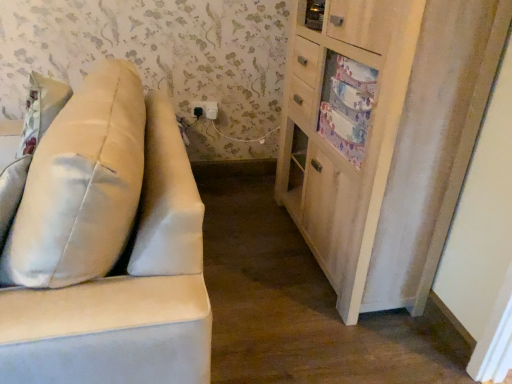
Question: Is satin beige pillow at left further to camera compared to suede-like beige sofa at left?

Choices:
 (A) no
 (B) yes

Answer: (B)

Question: Considering the relative sizes of satin beige pillow at left and suede-like beige sofa at left in the image provided, is satin beige pillow at left thinner than suede-like beige sofa at left?

Choices:
 (A) yes
 (B) no

Answer: (A)

Question: Is satin beige pillow at left closer to the viewer compared to suede-like beige sofa at left?

Choices:
 (A) no
 (B) yes

Answer: (A)

Question: Is suede-like beige sofa at left a part of satin beige pillow at left?

Choices:
 (A) yes
 (B) no

Answer: (B)

Question: Does satin beige pillow at left have a greater height compared to suede-like beige sofa at left?

Choices:
 (A) no
 (B) yes

Answer: (A)

Question: Which is correct: black plastic electric outlet at upper center is inside satin beige pillow at left, or outside of it?

Choices:
 (A) outside
 (B) inside

Answer: (A)

Question: Is black plastic electric outlet at upper center taller or shorter than satin beige pillow at left?

Choices:
 (A) tall
 (B) short

Answer: (B)

Question: From the image's perspective, is black plastic electric outlet at upper center above or below satin beige pillow at left?

Choices:
 (A) above
 (B) below

Answer: (A)

Question: From a real-world perspective, relative to satin beige pillow at left, is black plastic electric outlet at upper center vertically above or below?

Choices:
 (A) below
 (B) above

Answer: (A)

Question: In terms of height, does suede-like beige sofa at left look taller or shorter compared to light wood cabinet at right?

Choices:
 (A) tall
 (B) short

Answer: (B)

Question: Is suede-like beige sofa at left situated inside light wood cabinet at right or outside?

Choices:
 (A) inside
 (B) outside

Answer: (B)

Question: Considering their positions, is suede-like beige sofa at left located in front of or behind light wood cabinet at right?

Choices:
 (A) front
 (B) behind

Answer: (A)

Question: From the image's perspective, is suede-like beige sofa at left located above or below light wood cabinet at right?

Choices:
 (A) below
 (B) above

Answer: (A)

Question: Relative to black plastic electric outlet at upper center, is suede-like beige sofa at left in front or behind?

Choices:
 (A) behind
 (B) front

Answer: (B)

Question: From the image's perspective, is suede-like beige sofa at left positioned above or below black plastic electric outlet at upper center?

Choices:
 (A) above
 (B) below

Answer: (B)